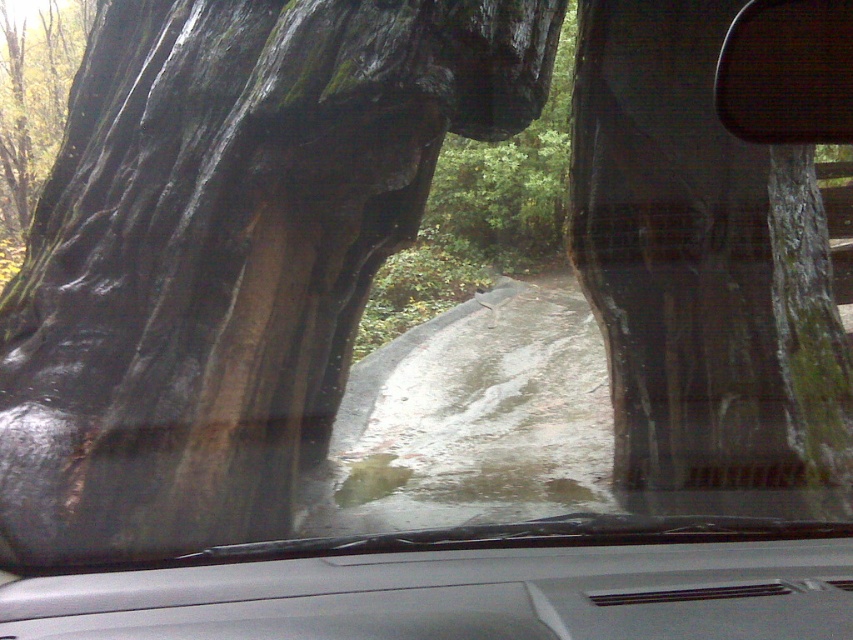
You are driving on a wet forest road and notice two tree trunks in your view through the windshield. One is the green mossy bark at right and the other is the green rough bark at upper left. Which tree trunk is closer to your car?

The green mossy bark at right is closer to the car because it is positioned in front of the green rough bark at upper left.

You are a botanist examining the bark textures in the image. Which of the two barks, the green mossy bark at right or the green rough bark at upper left, has a more extensive surface area based on their sizes?

The green mossy bark at right has a larger size compared to the green rough bark at upper left, so it has a more extensive surface area.